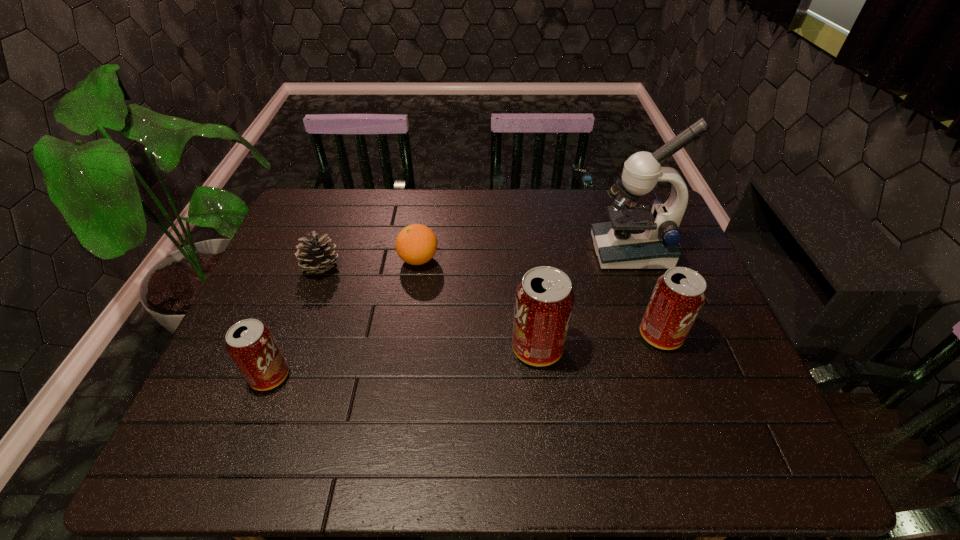
Locate which soda can ranks second in proximity to the microscope. Please provide its 2D coordinates. Your answer should be formatted as a tuple, i.e. [(x, y)], where the tuple contains the x and y coordinates of a point satisfying the conditions above.

[(544, 300)]

I want to click on the third closest soda can to the fourth object from right to left, so click(678, 296).

Locate an element on the screen. blank space that satisfies the following two spatial constraints: 1. on the back side of the fourth object from right to left; 2. on the left side of the third shortest object is located at coordinates (316, 259).